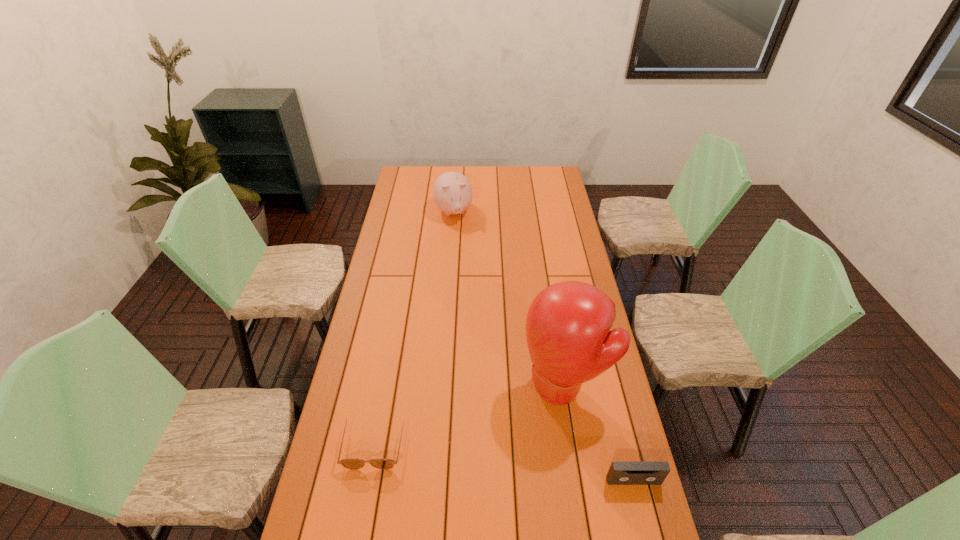
I want to click on free location located at the snout of the third shortest object, so click(x=462, y=246).

Locate an element on the screen. The width and height of the screenshot is (960, 540). free location located on the striking surface of the tallest object is located at coordinates (507, 422).

I want to click on free space located 0.400m on the striking surface of the tallest object, so click(425, 480).

Where is `free space located 0.390m on the striking surface of the tallest object`? The image size is (960, 540). free space located 0.390m on the striking surface of the tallest object is located at coordinates (428, 477).

This screenshot has height=540, width=960. What are the coordinates of `object located in the left edge section of the desktop` in the screenshot? It's located at (351, 463).

Identify the location of videotape that is positioned at the right edge. This screenshot has height=540, width=960. (620, 473).

Identify the location of boxing glove located at the right edge. [x=568, y=324].

Identify the location of blank space at the near edge of the desktop. (537, 532).

In the image, there is a desktop. Identify the location of free space at the left edge. pos(351,422).

Identify the location of free spot at the right edge of the desktop. The height and width of the screenshot is (540, 960). (545, 190).